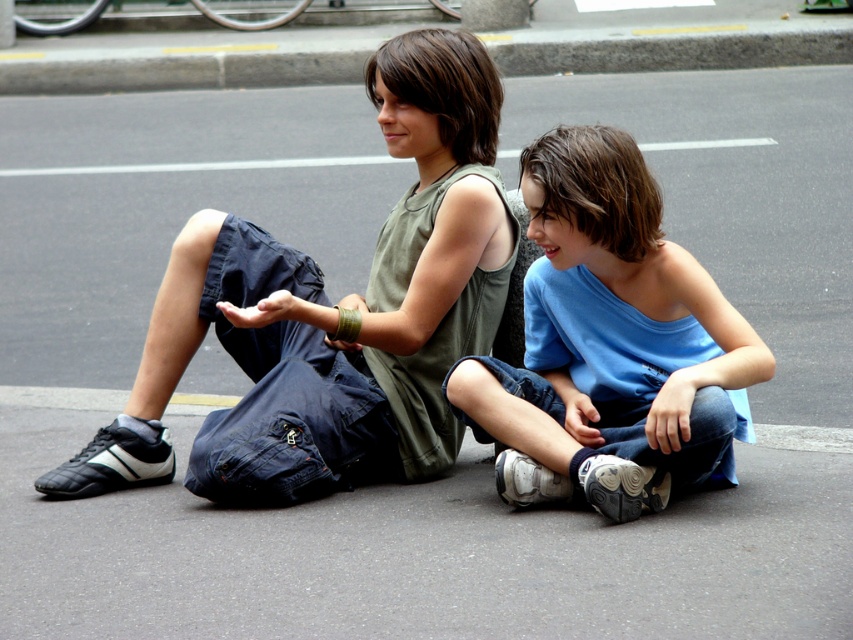
Does matte green tank top at center have a lesser width compared to blue cotton shirt at center?

In fact, matte green tank top at center might be wider than blue cotton shirt at center.

In the scene shown: Who is more forward, (405, 243) or (572, 212)?

Point (572, 212) is more forward.

Is point (276, 340) in front of point (619, 221)?

No.

Image resolution: width=853 pixels, height=640 pixels. I want to click on matte green tank top at center, so click(334, 314).

Between matte green tank top at center and gray concrete curb at upper center, which one has more height?

With more height is matte green tank top at center.

How much distance is there between matte green tank top at center and gray concrete curb at upper center?

matte green tank top at center is 8.90 meters from gray concrete curb at upper center.

Does point (401, 404) come closer to viewer compared to point (213, 45)?

Yes, point (401, 404) is closer to viewer.

This screenshot has width=853, height=640. Identify the location of matte green tank top at center. (334, 314).

Is point (595, 275) positioned in front of point (180, 65)?

Yes, it is in front of point (180, 65).

Is blue cotton shirt at center shorter than gray concrete curb at upper center?

In fact, blue cotton shirt at center may be taller than gray concrete curb at upper center.

The image size is (853, 640). Find the location of `blue cotton shirt at center`. blue cotton shirt at center is located at coordinates (610, 342).

Locate an element on the screen. This screenshot has height=640, width=853. blue cotton shirt at center is located at coordinates (610, 342).